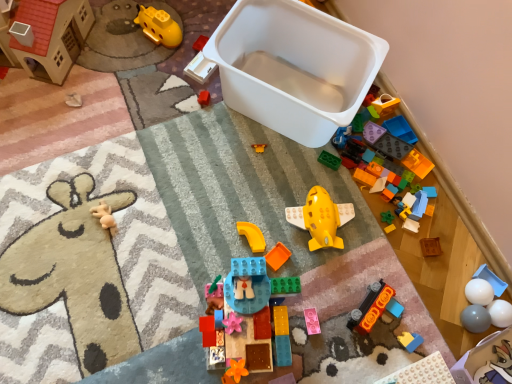
Question: Is pearl white plastic plate at lower right, which is counted as the 13th toy, starting from the left, oriented towards wooden block at center, which is the third toy from right to left?

Choices:
 (A) yes
 (B) no

Answer: (B)

Question: Does pearl white plastic plate at lower right, which is counted as the 13th toy, starting from the left, appear on the right side of wooden block at center, which is the third toy from right to left?

Choices:
 (A) yes
 (B) no

Answer: (B)

Question: Can you confirm if pearl white plastic plate at lower right, which is counted as the 13th toy, starting from the left, is shorter than wooden block at center, which is the third toy from right to left?

Choices:
 (A) no
 (B) yes

Answer: (A)

Question: Are pearl white plastic plate at lower right, which is counted as the 13th toy, starting from the left, and wooden block at center, arranged as the fourteenth toy when viewed from the left, far apart?

Choices:
 (A) no
 (B) yes

Answer: (A)

Question: Can you confirm if pearl white plastic plate at lower right, which is counted as the 13th toy, starting from the left, is smaller than wooden block at center, arranged as the fourteenth toy when viewed from the left?

Choices:
 (A) yes
 (B) no

Answer: (B)

Question: Is point (174, 41) positioned closer to the camera than point (414, 342)?

Choices:
 (A) farther
 (B) closer

Answer: (A)

Question: From the image's perspective, is yellow plastic submarine at upper left, which appears as the third toy when viewed from the left, positioned above or below matte plastic toy at lower right, which is counted as the 12th toy, starting from the left?

Choices:
 (A) below
 (B) above

Answer: (B)

Question: Looking at the image, does yellow plastic submarine at upper left, which appears as the third toy when viewed from the left, seem bigger or smaller compared to matte plastic toy at lower right, which is counted as the 12th toy, starting from the left?

Choices:
 (A) small
 (B) big

Answer: (B)

Question: Would you say yellow plastic submarine at upper left, which ranks as the fourteenth toy in right-to-left order, is inside or outside matte plastic toy at lower right, the 5th toy viewed from the right?

Choices:
 (A) outside
 (B) inside

Answer: (A)

Question: Considering the relative positions of yellow plastic submarine at upper left, which ranks as the fourteenth toy in right-to-left order, and pink matte block at center, the tenth toy positioned from the right, in the image provided, is yellow plastic submarine at upper left, which ranks as the fourteenth toy in right-to-left order, to the left or to the right of pink matte block at center, the tenth toy positioned from the right,?

Choices:
 (A) right
 (B) left

Answer: (B)

Question: Is yellow plastic submarine at upper left, which ranks as the fourteenth toy in right-to-left order, wider or thinner than pink matte block at center, the 7th toy from the left?

Choices:
 (A) thin
 (B) wide

Answer: (B)

Question: From the image's perspective, is yellow plastic submarine at upper left, which ranks as the fourteenth toy in right-to-left order, located above or below pink matte block at center, the tenth toy positioned from the right?

Choices:
 (A) below
 (B) above

Answer: (B)

Question: In terms of height, does yellow plastic submarine at upper left, which appears as the third toy when viewed from the left, look taller or shorter compared to pink matte block at center, the tenth toy positioned from the right?

Choices:
 (A) tall
 (B) short

Answer: (A)

Question: Is point (378, 311) positioned closer to the camera than point (455, 372)?

Choices:
 (A) farther
 (B) closer

Answer: (B)

Question: In the image, is orange matte car at lower right, the 8th toy in the right-to-left sequence, positioned in front of or behind white plastic storage box at lower right, the 2th storage box from the top?

Choices:
 (A) behind
 (B) front

Answer: (A)